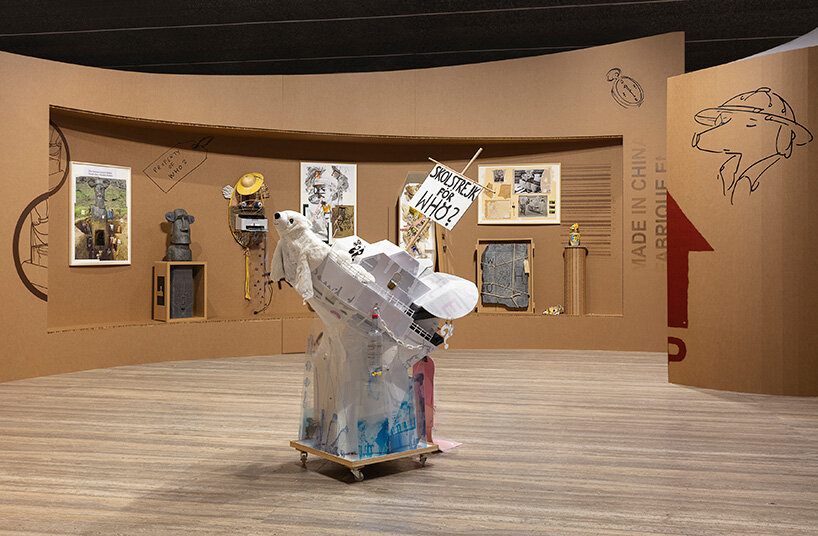
At what (x,y) coordinates should I click in order to perform the action: click on glass bottle. Please return your answer as a coordinate pair (x, y). Image resolution: width=818 pixels, height=536 pixels. Looking at the image, I should click on (375, 351).